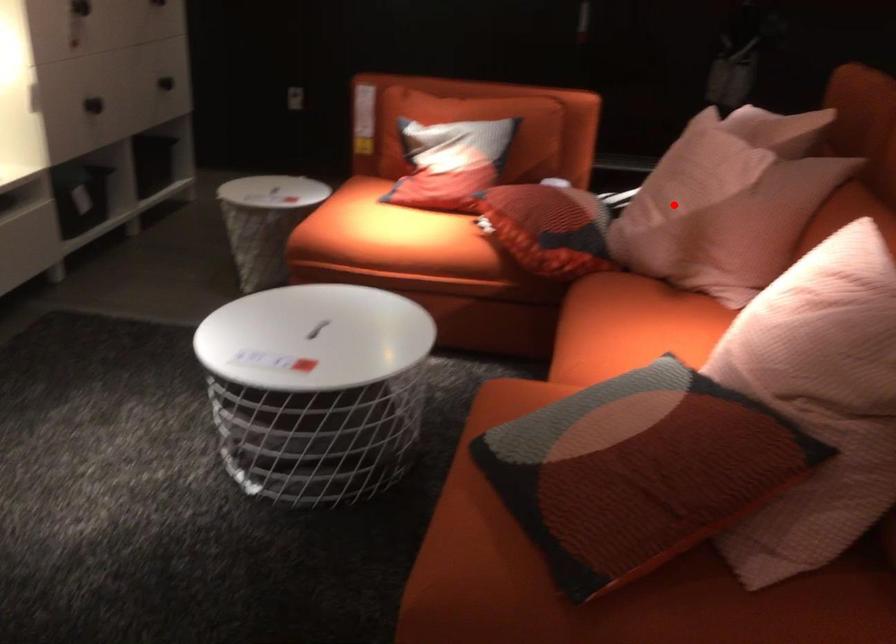
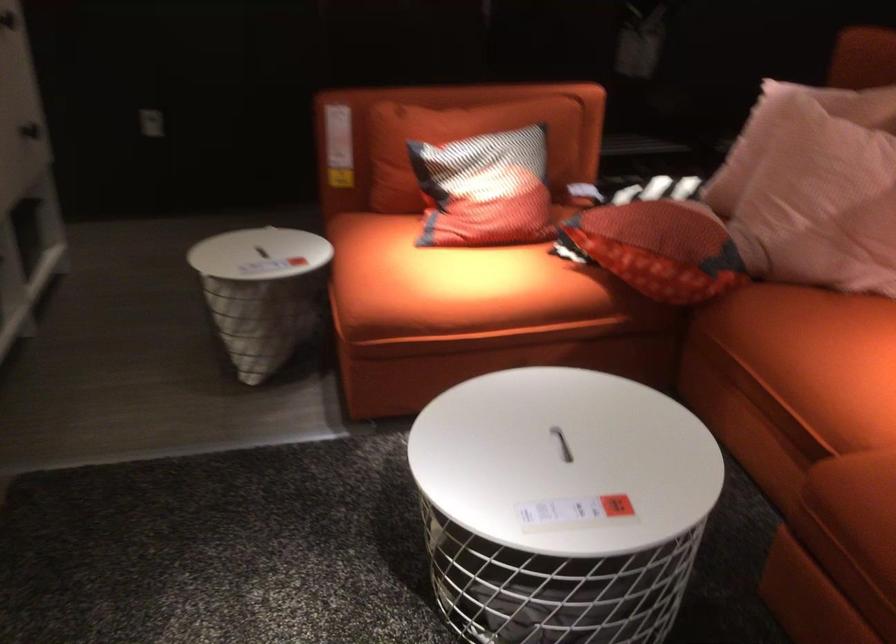
In the second image, find the point that corresponds to the highlighted location in the first image.

(823, 198)